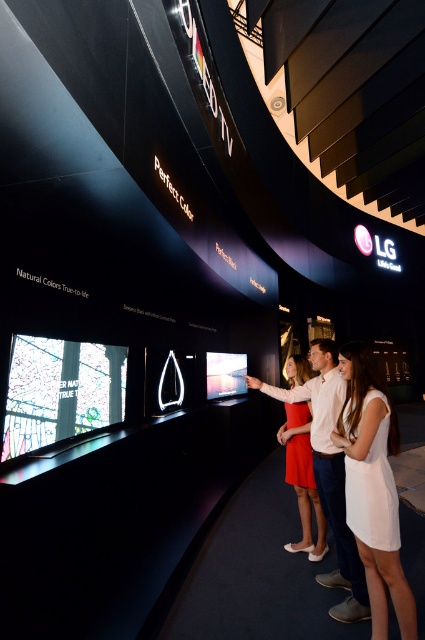
You are standing at the origin point in the image. Where is the white cotton dress at center located?

The white cotton dress at center is located at point 0.762 on the x axis and 0.878 on the y axis.

You are a photographer taking a group photo of the white cotton shirt at center and the matte red dress at center. Which clothing item should you place to the left to ensure they are aligned properly according to their current positions?

The matte red dress at center should be placed to the left since the white cotton shirt at center is currently on the right side of the matte red dress at center.

You are an event organizer who needs to decide if a rectangular banner measuring 1.2 meters in width can fit between the white cotton shirt at center and the matte black video game at center. Based on their widths, can the banner be placed there?

The white cotton shirt at center is narrower than the matte black video game at center. Since the banner is 1.2 meters wide, but the total available space between them isn